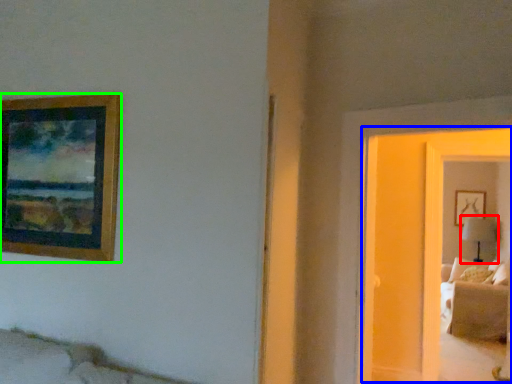
Question: Based on their relative distances, which object is farther from table lamp (highlighted by a red box)? Choose from glass door (highlighted by a blue box) and picture frame (highlighted by a green box).

Choices:
 (A) glass door
 (B) picture frame

Answer: (B)